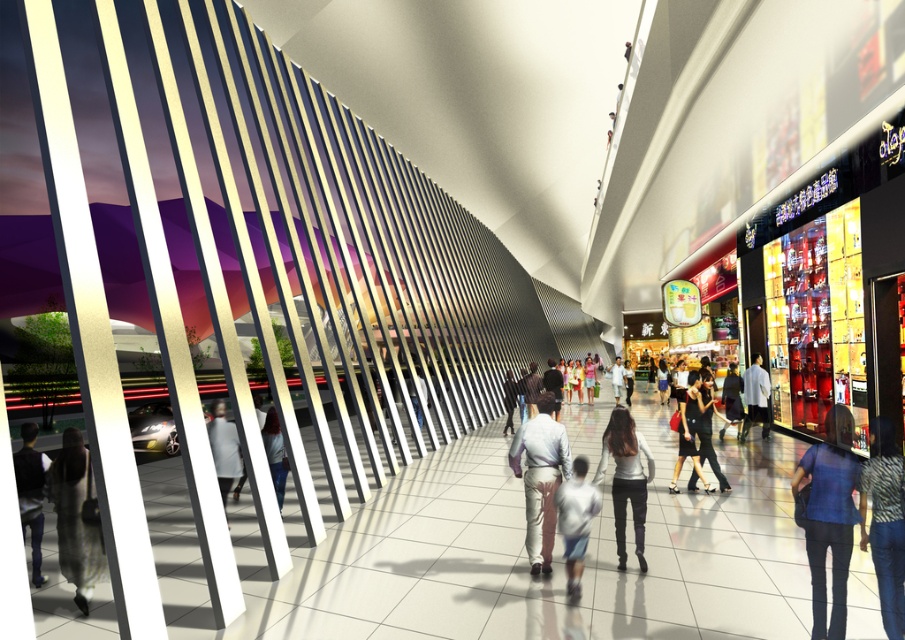
Does blue denim jeans at lower right come in front of matte black dress at center?

That is True.

Locate an element on the screen. The width and height of the screenshot is (905, 640). blue denim jeans at lower right is located at coordinates (830, 516).

Where is `blue denim jeans at lower right`? blue denim jeans at lower right is located at coordinates (830, 516).

Is point (550, 392) positioned before point (272, 435)?

Yes.

Does light beige pants at center have a larger size compared to denim pants at center?

Actually, light beige pants at center might be smaller than denim pants at center.

Is point (534, 476) more distant than point (284, 458)?

No, it is in front of (284, 458).

Image resolution: width=905 pixels, height=640 pixels. In order to click on light beige pants at center in this screenshot , I will do `click(540, 477)`.

Can you confirm if matte black dress at center is taller than black leather jacket at center?

Correct, matte black dress at center is much taller as black leather jacket at center.

Which is in front, point (686, 410) or point (706, 403)?

Point (686, 410)

At what (x,y) coordinates should I click in order to perform the action: click on matte black dress at center. Please return your answer as a coordinate pair (x, y). Looking at the image, I should click on (689, 429).